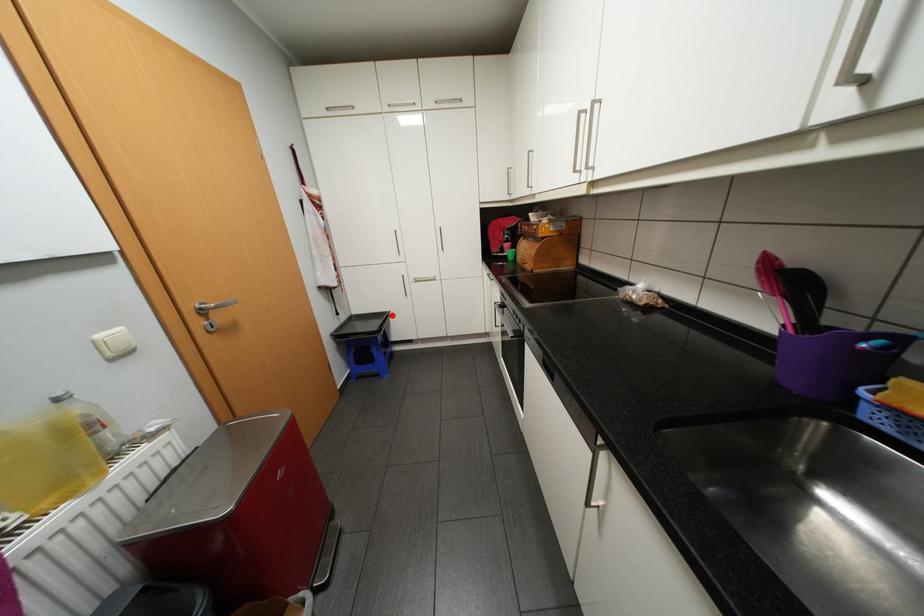
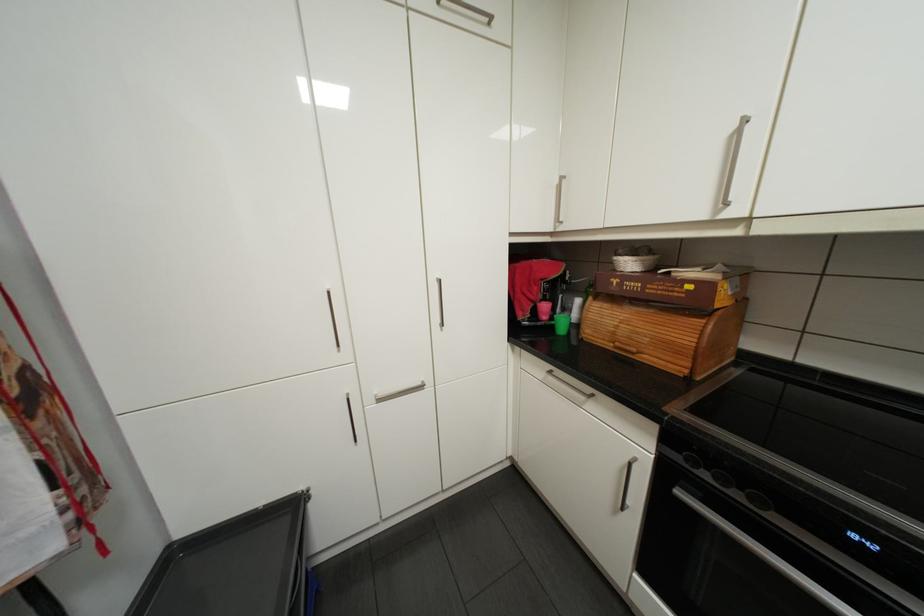
In the second image, find the point that corresponds to the highlighted location in the first image.

(300, 507)